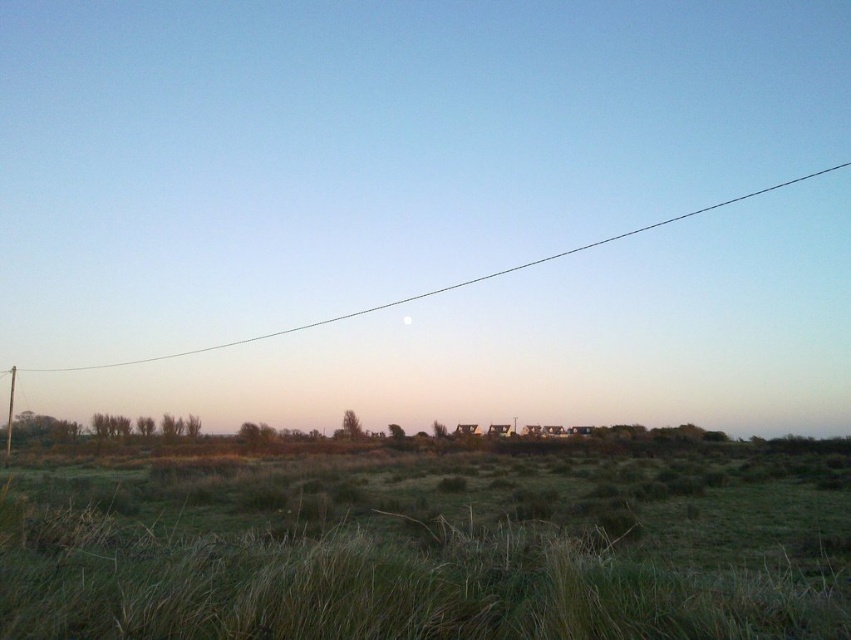
In the scene shown: You are standing in the rural landscape scene. You see the green grassy at lower center and the white glossy moon at upper center. Which object is nearer to you?

The green grassy at lower center is closer to the viewer than the white glossy moon at upper center.

You are standing in the field of tall dry grasses in the foreground of the image. You see two points marked in the scene. The first point is at coordinate point (107, 362) and the second is at point (410, 317). Which point is closer to you?

Point (107, 362) is further to the camera than point (410, 317), so the second point at (410, 317) is closer to you.